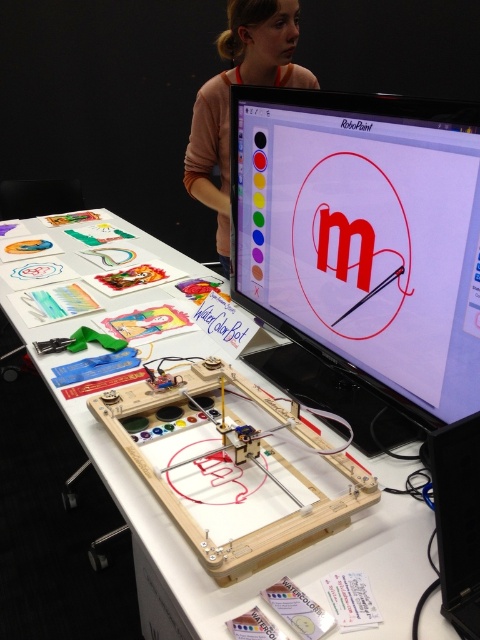
Does matte plastic monitor at upper center have a greater width compared to white wood table at center?

Incorrect, matte plastic monitor at upper center's width does not surpass white wood table at center's.

Between point (312, 113) and point (47, 228), which one is positioned in front?

Point (312, 113)

Between point (465, 294) and point (167, 586), which one is positioned behind?

The point (465, 294) is behind.

Locate an element on the screen. The width and height of the screenshot is (480, 640). matte plastic monitor at upper center is located at coordinates (363, 237).

Between point (136, 476) and point (266, 29), which one is positioned in front?

Positioned in front is point (136, 476).

Find the location of a particular element. The width and height of the screenshot is (480, 640). white wood table at center is located at coordinates (191, 548).

Does wooden board game at center come behind pink fabric at upper center?

No, wooden board game at center is in front of pink fabric at upper center.

Does point (305, 445) lie in front of point (220, 209)?

Yes.

Find the location of a particular element. wooden board game at center is located at coordinates (x=228, y=467).